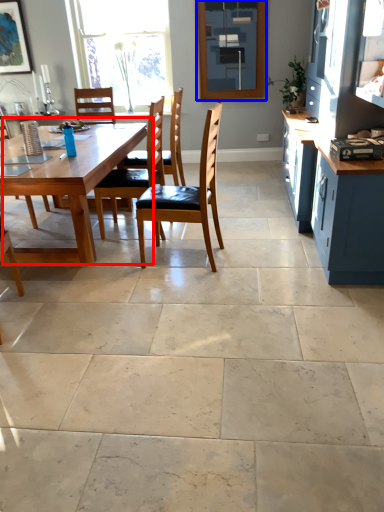
Question: Which object appears farthest to the camera in this image, kitchen & dining room table (highlighted by a red box) or window screen (highlighted by a blue box)?

Choices:
 (A) kitchen & dining room table
 (B) window screen

Answer: (B)